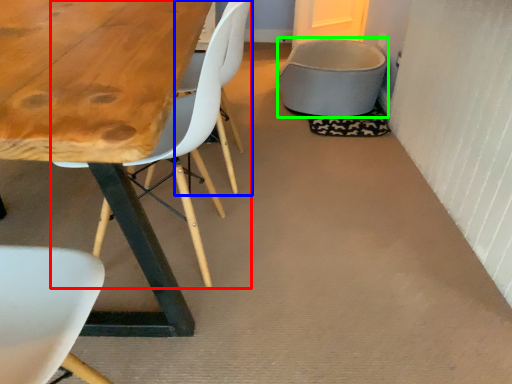
Question: Which is nearer to the chair (highlighted by a red box)? armchair (highlighted by a blue box) or gray (highlighted by a green box).

Choices:
 (A) armchair
 (B) gray

Answer: (A)